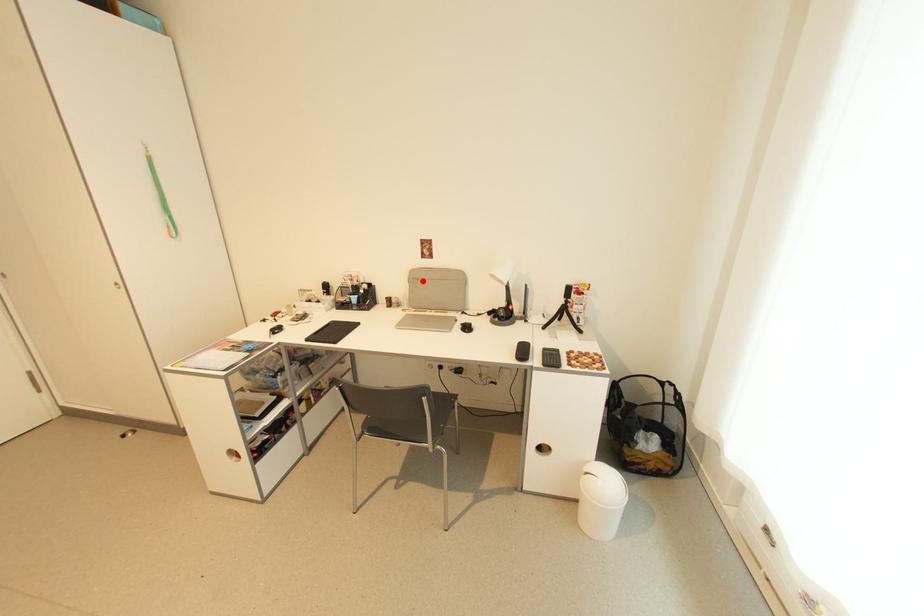
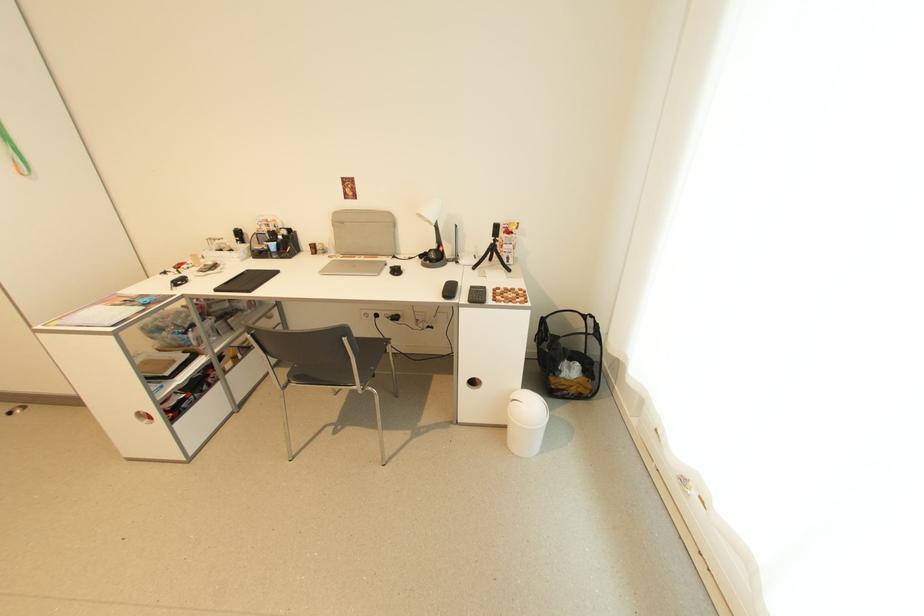
Question: I am providing you with two images of the same scene from different viewpoints. Image1 has a red point marked. In image2, the corresponding 3D location appears at what relative position? Reply with the corresponding letter.

Choices:
 (A) Closer
 (B) Farther

Answer: (A)